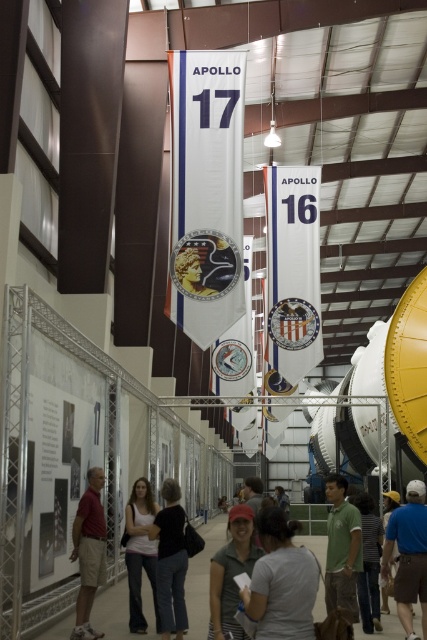
You are an event organizer planning to place a 1.2 meter wide decorative panel between the dark gray pants at center and the red shirt at left. Based on their widths, will the panel fit between them?

The dark gray pants at center has a lesser width compared to red shirt at left, so the panel may not fit as the total width of both objects might exceed the panel width. However, without exact spacing data between them, it is uncertain.

You are standing in the exhibition space and want to take a photo of both the dark gray pants at center and the red shirt at left. Which object should you focus on first to ensure both are in the frame?

You should focus on the dark gray pants at center first because it is closer to the viewer than the red shirt at left, ensuring both are in the frame.